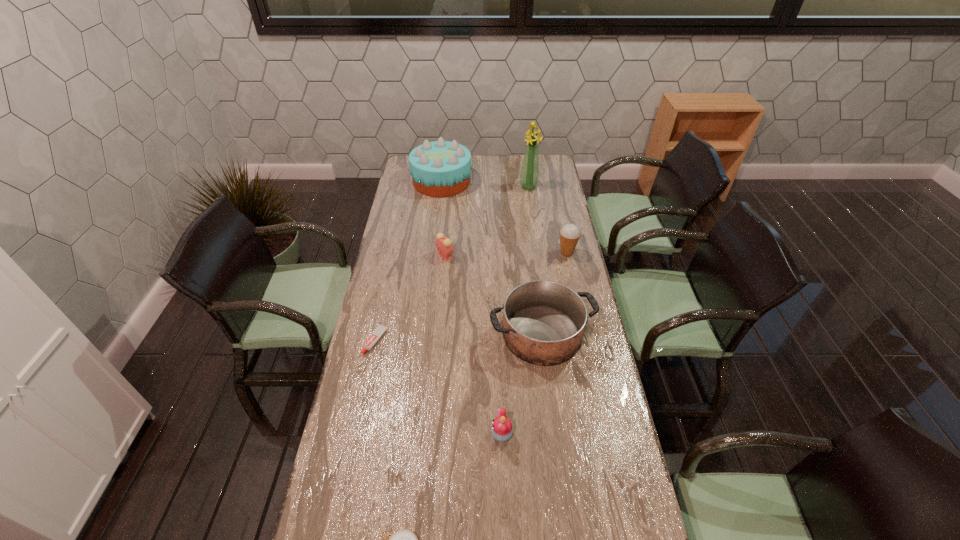
This screenshot has height=540, width=960. Identify the location of free space between the alarm clock and the bouquet. (487, 221).

This screenshot has width=960, height=540. Identify the location of object that is the closest to the toothpaste. (x=543, y=321).

Locate which object is the fifth closest to the cake. Please provide its 2D coordinates. Your answer should be formatted as a tuple, i.e. [(x, y)], where the tuple contains the x and y coordinates of a point satisfying the conditions above.

[(380, 329)]

The height and width of the screenshot is (540, 960). Find the location of `free space that satisfies the following two spatial constraints: 1. on the front-facing side of the tallest object; 2. on the face of the alarm clock`. free space that satisfies the following two spatial constraints: 1. on the front-facing side of the tallest object; 2. on the face of the alarm clock is located at coordinates (539, 255).

I want to click on vacant region that satisfies the following two spatial constraints: 1. on the back side of the toothpaste; 2. on the left side of the icecream, so click(395, 253).